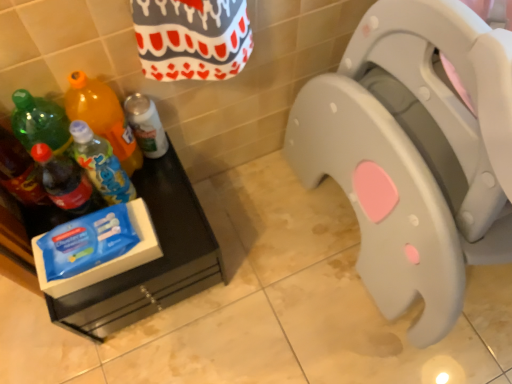
Question: Should I look upward or downward to see blue plastic bottle at left, arranged as the fourth bottle when viewed from the left?

Choices:
 (A) down
 (B) up

Answer: (B)

Question: Does blue plastic bottle at left, placed as the second bottle when sorted from right to left, have a larger size compared to translucent plastic soda bottle at left, the fourth bottle when ordered from right to left?

Choices:
 (A) yes
 (B) no

Answer: (B)

Question: Is blue plastic bottle at left, arranged as the fourth bottle when viewed from the left, turned away from translucent plastic soda bottle at left, the fourth bottle when ordered from right to left?

Choices:
 (A) yes
 (B) no

Answer: (B)

Question: From a real-world perspective, is blue plastic bottle at left, placed as the second bottle when sorted from right to left, positioned over translucent plastic soda bottle at left, which is the second bottle from left to right, based on gravity?

Choices:
 (A) yes
 (B) no

Answer: (B)

Question: Is blue plastic bottle at left, placed as the second bottle when sorted from right to left, at the left side of translucent plastic soda bottle at left, the fourth bottle when ordered from right to left?

Choices:
 (A) yes
 (B) no

Answer: (B)

Question: Could you tell me if blue plastic bottle at left, arranged as the fourth bottle when viewed from the left, is facing translucent plastic soda bottle at left, which is the second bottle from left to right?

Choices:
 (A) no
 (B) yes

Answer: (A)

Question: From a real-world perspective, is blue plastic bottle at left, arranged as the fourth bottle when viewed from the left, below translucent plastic soda bottle at left, which is the second bottle from left to right?

Choices:
 (A) yes
 (B) no

Answer: (A)

Question: Is white matte spray can at lower left, which ranks as the 5th bottle in left-to-right order, next to blue plastic bottle at left, arranged as the fourth bottle when viewed from the left?

Choices:
 (A) yes
 (B) no

Answer: (B)

Question: Is blue plastic bottle at left, placed as the second bottle when sorted from right to left, inside white matte spray can at lower left, which ranks as the 5th bottle in left-to-right order?

Choices:
 (A) no
 (B) yes

Answer: (A)

Question: Considering the relative positions of white matte spray can at lower left, which ranks as the 5th bottle in left-to-right order, and blue plastic bottle at left, arranged as the fourth bottle when viewed from the left, in the image provided, is white matte spray can at lower left, which ranks as the 5th bottle in left-to-right order, to the right of blue plastic bottle at left, arranged as the fourth bottle when viewed from the left, from the viewer's perspective?

Choices:
 (A) no
 (B) yes

Answer: (B)

Question: Can you confirm if white matte spray can at lower left, which ranks as the 5th bottle in left-to-right order, is smaller than blue plastic bottle at left, placed as the second bottle when sorted from right to left?

Choices:
 (A) no
 (B) yes

Answer: (B)

Question: Can you confirm if white matte spray can at lower left, which ranks as the 5th bottle in left-to-right order, is bigger than blue plastic bottle at left, placed as the second bottle when sorted from right to left?

Choices:
 (A) yes
 (B) no

Answer: (B)

Question: Is white matte spray can at lower left, the first bottle positioned from the right, behind blue plastic bottle at left, arranged as the fourth bottle when viewed from the left?

Choices:
 (A) yes
 (B) no

Answer: (A)

Question: Is translucent plastic soda bottle at left, which is counted as the first bottle, starting from the left, further to camera compared to gray plastic toilet seat at center?

Choices:
 (A) yes
 (B) no

Answer: (A)